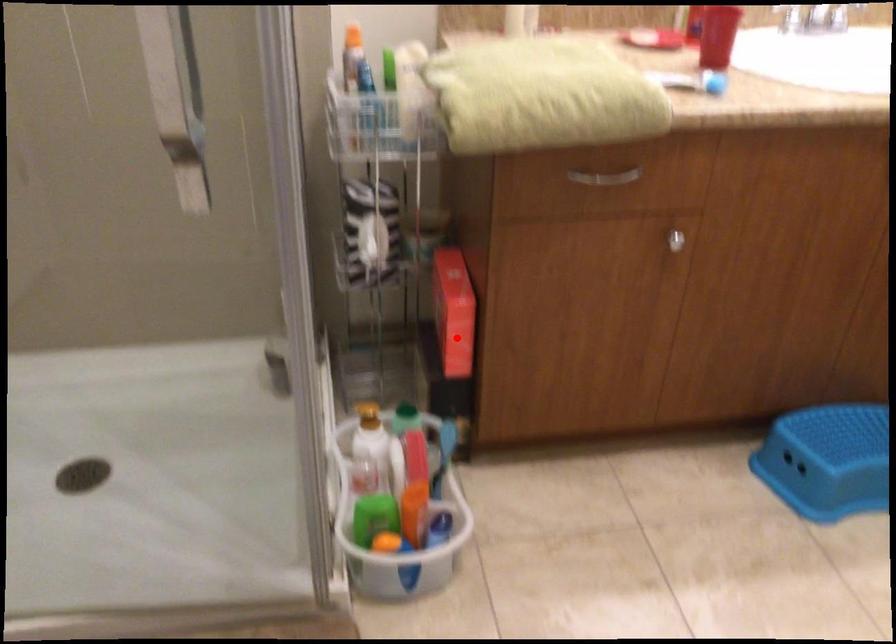
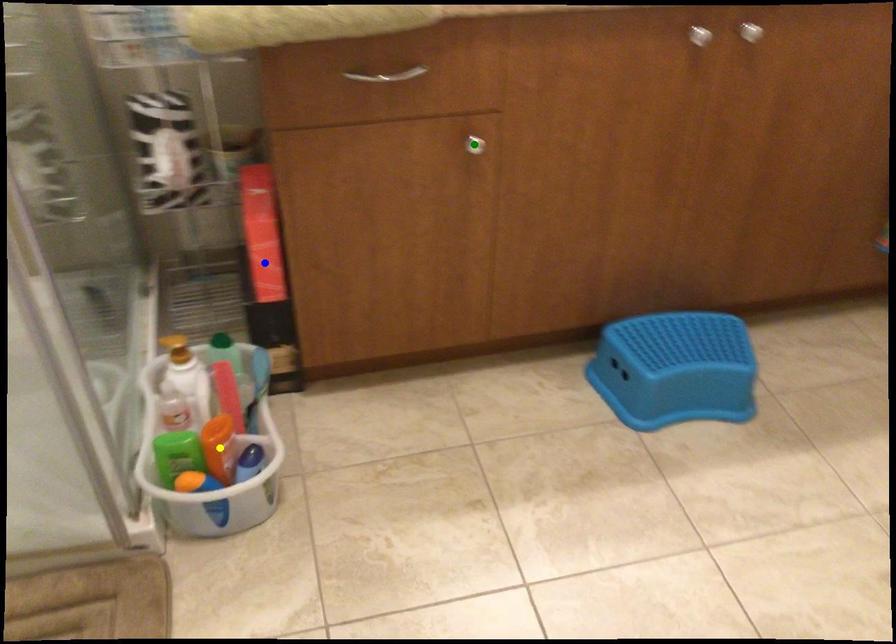
Question: I am providing you with two images of the same scene from different viewpoints. A red point is marked on the first image. You are given multiple points on the second image. In image 2, which mark is for the same physical point as the one in image 1?

Choices:
 (A) yellow point
 (B) green point
 (C) blue point

Answer: (C)